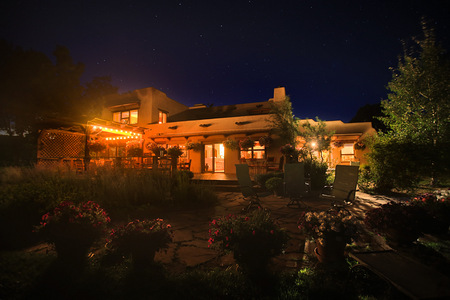
The image size is (450, 300). Find the location of `chair`. chair is located at coordinates (295, 188).